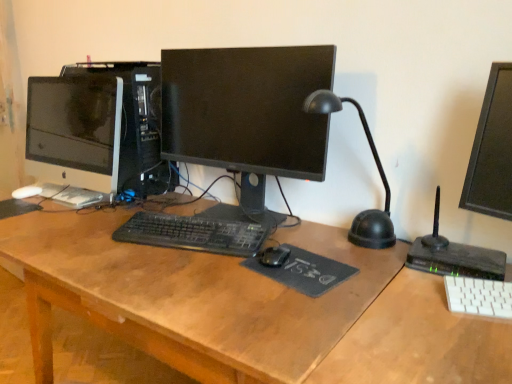
Where is `vacant space situated on the left part of black glossy monitor at center, the 1th computer monitor viewed from the right`? This screenshot has height=384, width=512. vacant space situated on the left part of black glossy monitor at center, the 1th computer monitor viewed from the right is located at coordinates (81, 234).